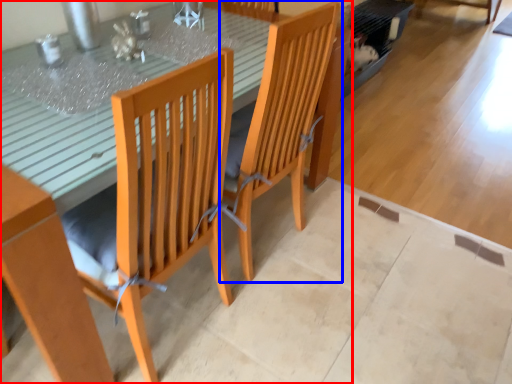
Question: Which object is closer to the camera taking this photo, table (highlighted by a red box) or chair (highlighted by a blue box)?

Choices:
 (A) table
 (B) chair

Answer: (A)